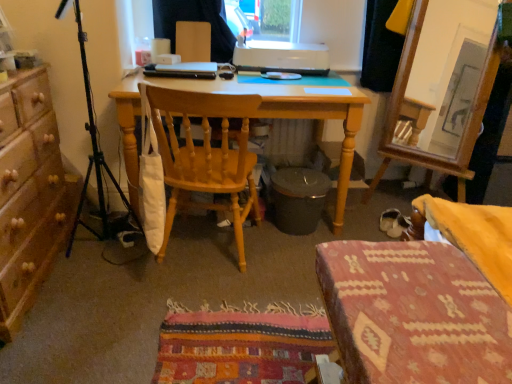
You are a GUI agent. You are given a task and a screenshot of the screen. Output one action in this format:
    pyautogui.click(x=<x>, y=<y>)
    Task: Click on the blank space above textured woolen stool at lower right (from a real-world perspective)
    
    Given the screenshot: What is the action you would take?
    pyautogui.click(x=419, y=292)